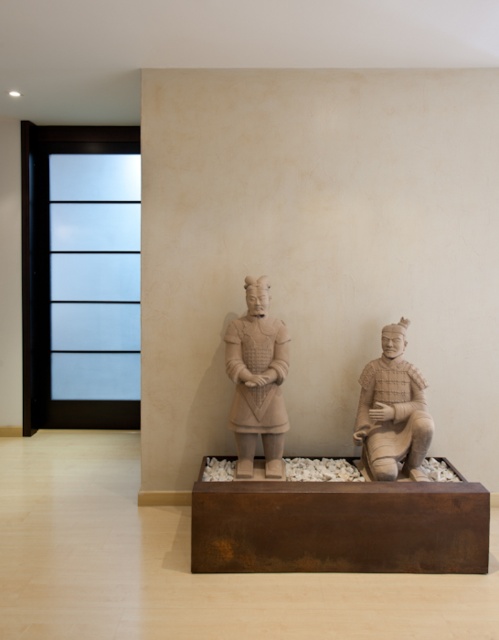
You are an interior designer planning to move the matte clay warrior at center and the matte clay figure at center to a new location. The new space has limited floor area. Which object should you prioritize moving first to ensure both can fit without overcrowding?

The matte clay warrior at center occupies less space than the matte clay figure at center, so you should move the matte clay figure at center first to accommodate its larger size, then place the smaller matte clay warrior at center alongside it.

In the scene shown: You are an art curator planning to move the matte clay warrior at center and the matte clay figure at center to a new exhibition space. The new space has a height restriction of 1.5 meters. Can both statues be moved without any modifications?

The matte clay warrior at center is above the matte clay figure at center, but the exact heights of each statue are not provided. Therefore, it is uncertain if both can be moved under the 1.5 meter height restriction without further measurements.